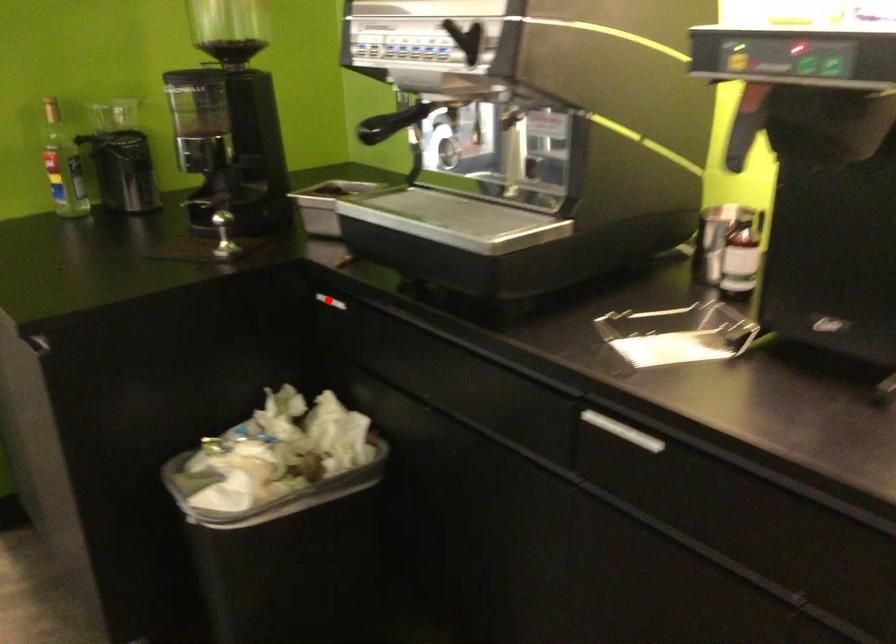
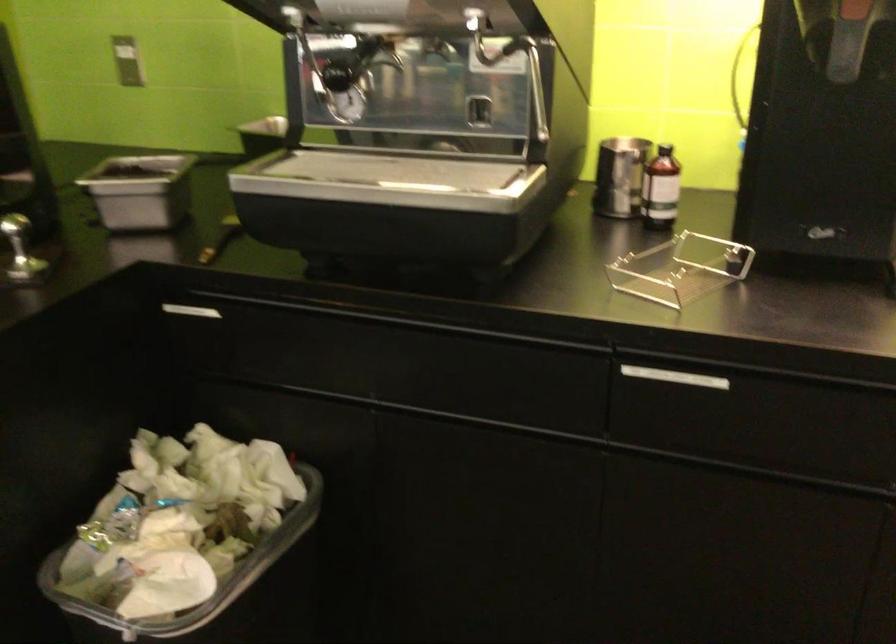
Question: I am providing you with two images of the same scene from different viewpoints. Image1 has a red point marked. In image2, the corresponding 3D location appears at what relative position? Reply with the corresponding letter.

Choices:
 (A) Closer
 (B) Farther

Answer: (A)